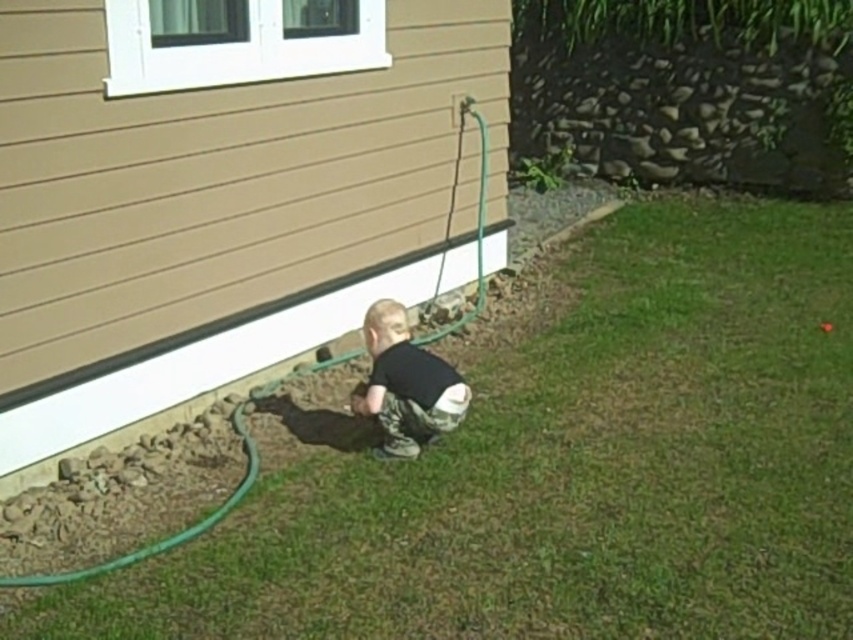
You are standing at the entrance of the house and want to reach the green grass at lower center. According to the coordinates provided, in which direction should you move from your current position?

The green grass at lower center is located at coordinates point (563, 467). Since lower center typically refers to a position closer to the bottom of the image, you should move forward towards the lower part of the scene to reach it.

You are a parent looking at the scene outside your house. You see the green grass at lower center and the black matte shirt at center. Which object is closer to the ground?

The green grass at lower center is positioned under the black matte shirt at center, so the green grass at lower center is closer to the ground.

You are a parent who wants to ensure your child stays on the green grass at lower center while playing. Since the green rubber hose at lower left is nearby, which area should the child avoid stepping on to stay on the grass?

The child should avoid stepping on the green rubber hose at lower left to stay on the green grass at lower center, as the grass area is larger and can accommodate more space for play.